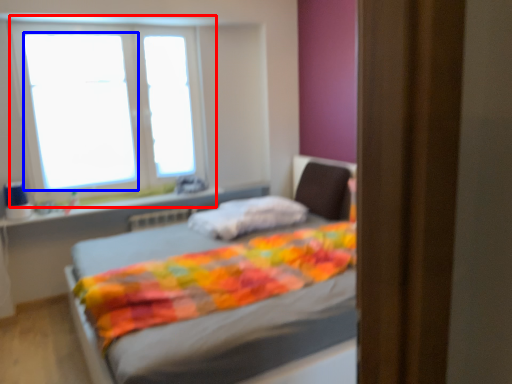
Question: Which of the following is the farthest to the observer, window (highlighted by a red box) or window screen (highlighted by a blue box)?

Choices:
 (A) window
 (B) window screen

Answer: (B)